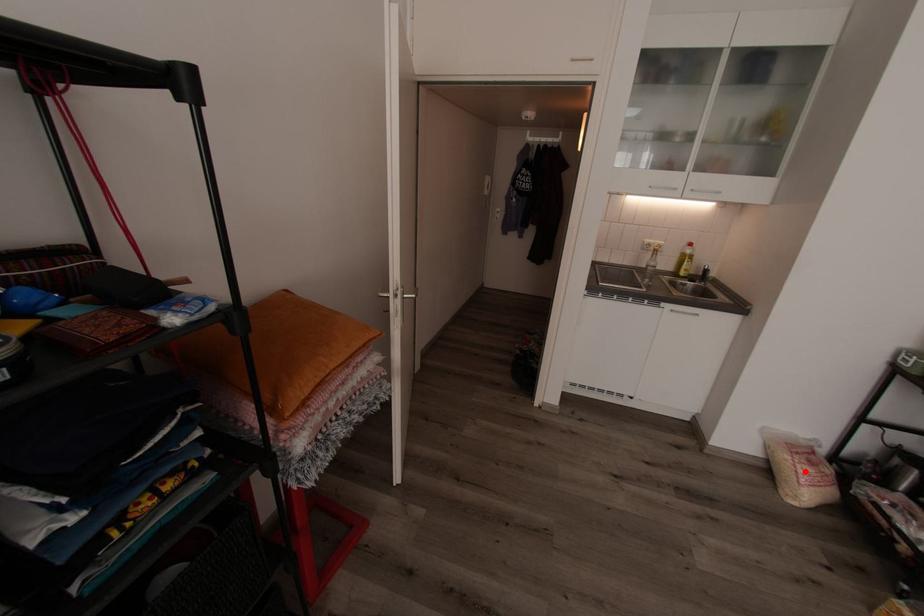
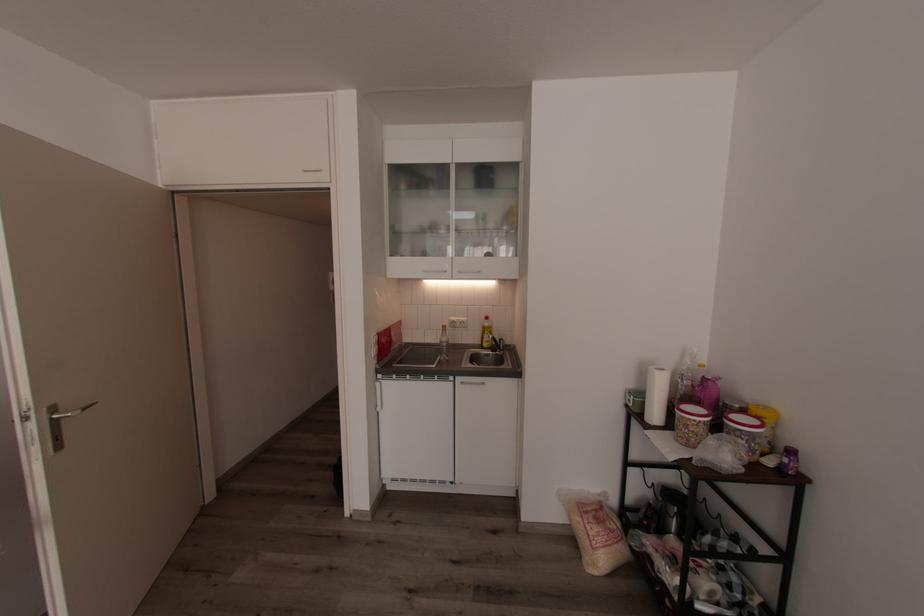
Question: I am providing you with two images of the same scene from different viewpoints. Image1 has a red point marked. In image2, the corresponding 3D location appears at what relative position? Reply with the corresponding letter.

Choices:
 (A) Closer
 (B) Farther

Answer: (B)